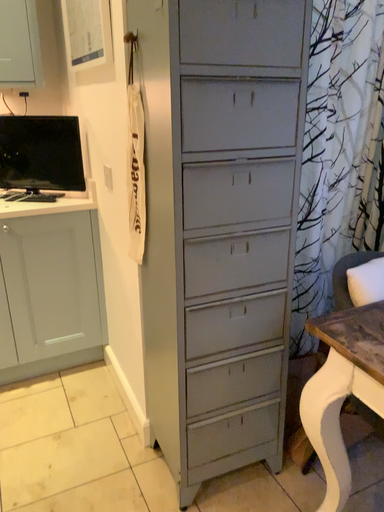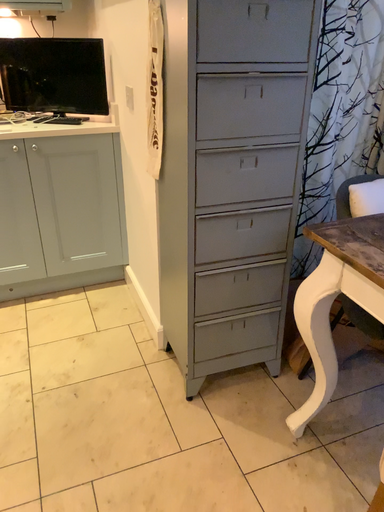
Question: Which way did the camera rotate in the video?

Choices:
 (A) rotated upward
 (B) rotated downward

Answer: (B)